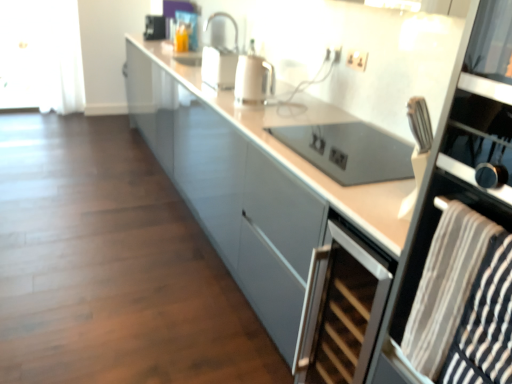
Where is `free region under satin silver oven at center, which ranks as the 1th appliance in front-to-back order (from a real-world perspective)`? free region under satin silver oven at center, which ranks as the 1th appliance in front-to-back order (from a real-world perspective) is located at coordinates (351, 150).